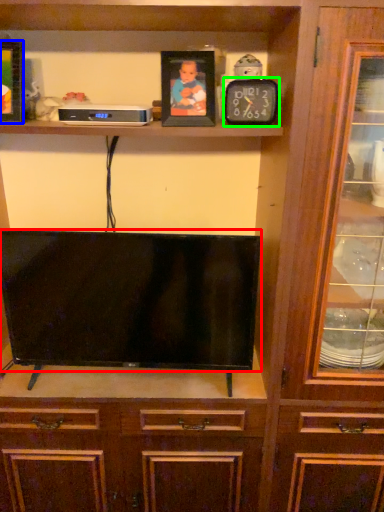
Question: Which is nearer to the television (highlighted by a red box)? picture frame (highlighted by a blue box) or clock (highlighted by a green box).

Choices:
 (A) picture frame
 (B) clock

Answer: (B)